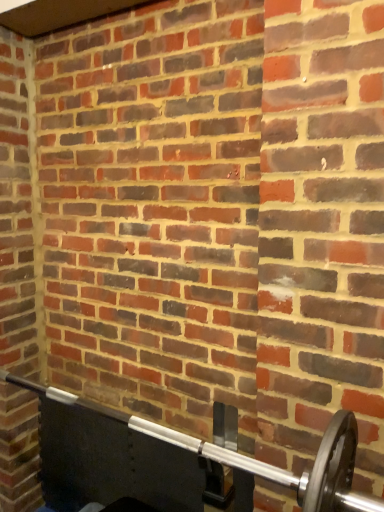
The image size is (384, 512). Describe the element at coordinates (176, 461) in the screenshot. I see `silver metallic barbell at center` at that location.

Where is `silver metallic barbell at center`? This screenshot has height=512, width=384. silver metallic barbell at center is located at coordinates (176, 461).

Where is `silver metallic barbell at center`? The image size is (384, 512). silver metallic barbell at center is located at coordinates (176, 461).